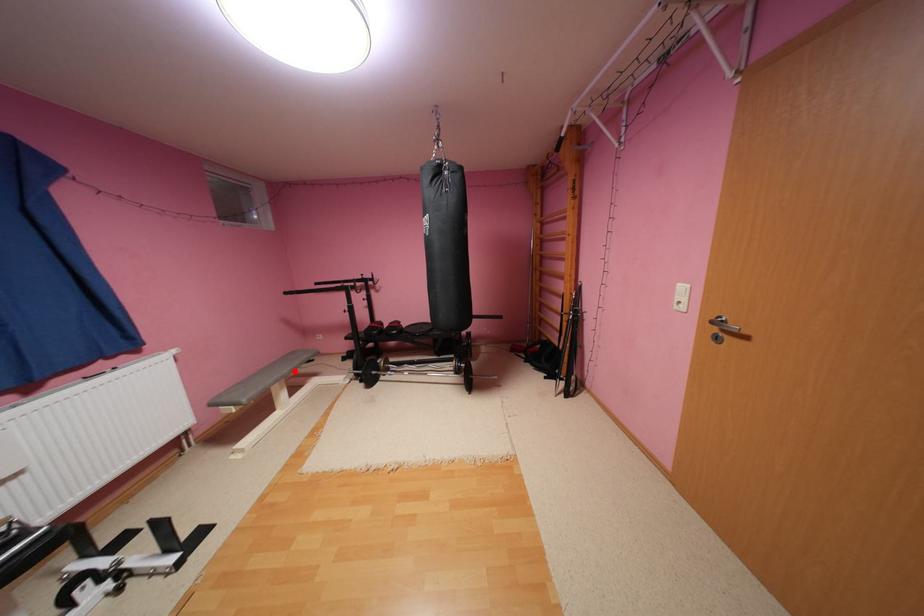
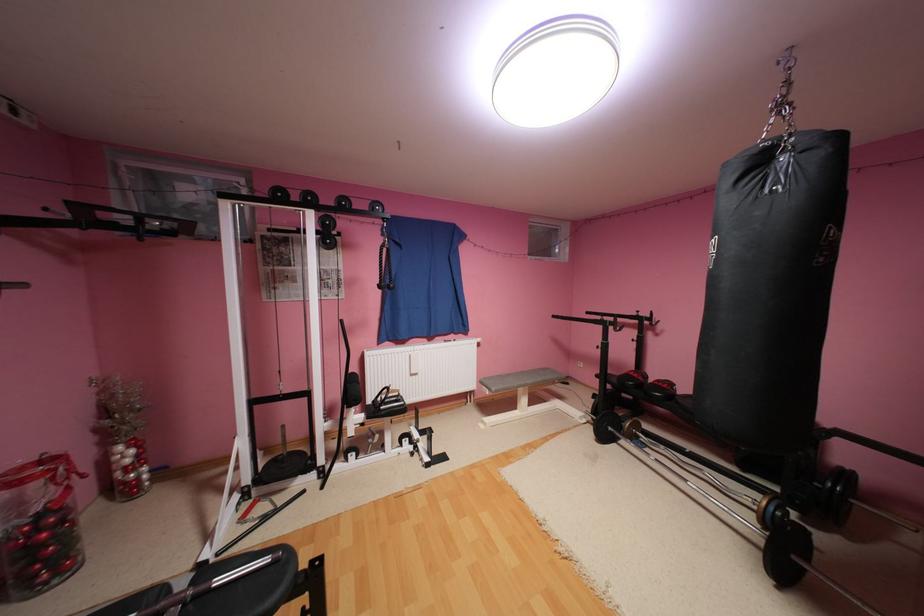
Question: A red point is marked in image1. In image2, is the corresponding 3D point closer to the camera or farther? Reply with the corresponding letter.

Choices:
 (A) The corresponding 3D point is closer.
 (B) The corresponding 3D point is farther.

Answer: (B)